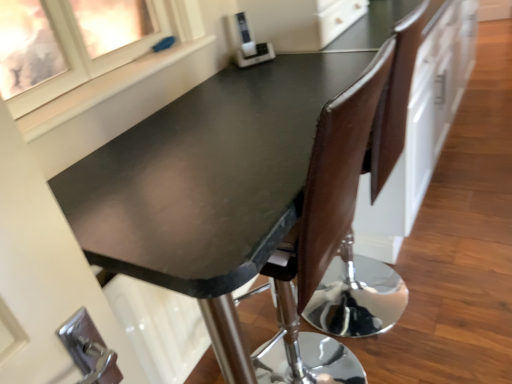
Question: From a real-world perspective, is matte glass window at upper left located beneath matte black table at center?

Choices:
 (A) no
 (B) yes

Answer: (A)

Question: Can you confirm if matte glass window at upper left is positioned to the left of matte black table at center?

Choices:
 (A) no
 (B) yes

Answer: (B)

Question: From the image's perspective, would you say matte glass window at upper left is shown under matte black table at center?

Choices:
 (A) yes
 (B) no

Answer: (B)

Question: From the image's perspective, is matte glass window at upper left above matte black table at center?

Choices:
 (A) no
 (B) yes

Answer: (B)

Question: Is matte glass window at upper left in front of matte black table at center?

Choices:
 (A) yes
 (B) no

Answer: (B)

Question: Is point (308, 165) closer or farther from the camera than point (121, 67)?

Choices:
 (A) farther
 (B) closer

Answer: (B)

Question: Choose the correct answer: Is matte black table at center inside white smooth window sill at upper left or outside it?

Choices:
 (A) outside
 (B) inside

Answer: (A)

Question: Is matte black table at center to the left or to the right of white smooth window sill at upper left in the image?

Choices:
 (A) left
 (B) right

Answer: (B)

Question: From the image's perspective, is matte black table at center above or below white smooth window sill at upper left?

Choices:
 (A) above
 (B) below

Answer: (B)

Question: In terms of width, does matte glass window at upper left look wider or thinner when compared to matte black table at center?

Choices:
 (A) wide
 (B) thin

Answer: (B)

Question: Does point (77, 61) appear closer or farther from the camera than point (352, 69)?

Choices:
 (A) closer
 (B) farther

Answer: (A)

Question: Is matte glass window at upper left bigger or smaller than matte black table at center?

Choices:
 (A) small
 (B) big

Answer: (A)

Question: Considering their positions, is matte glass window at upper left located in front of or behind matte black table at center?

Choices:
 (A) front
 (B) behind

Answer: (B)

Question: From a real-world perspective, is white plastic appliance at upper center above or below matte black table at center?

Choices:
 (A) above
 (B) below

Answer: (A)

Question: Do you think white plastic appliance at upper center is within matte black table at center, or outside of it?

Choices:
 (A) outside
 (B) inside

Answer: (A)